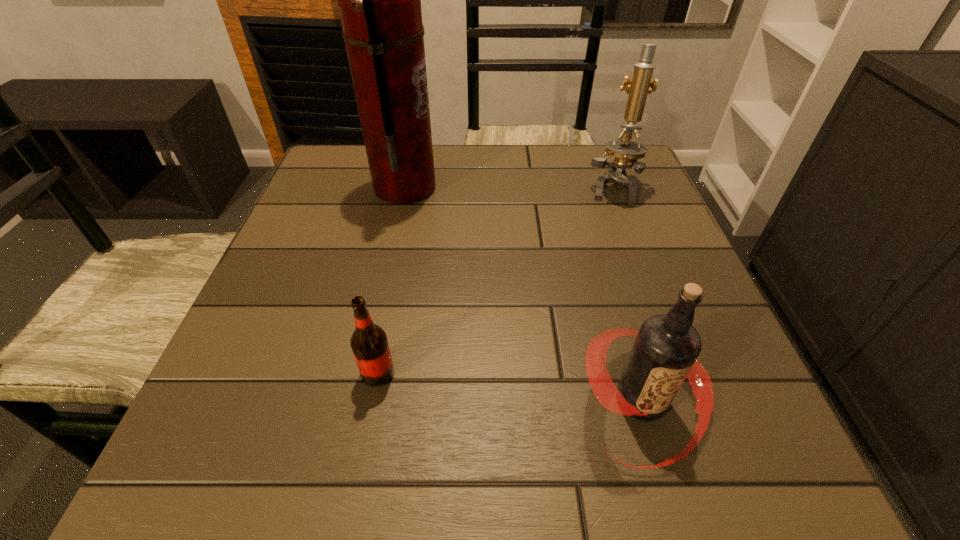
I want to click on vacant area between the tallest object and the shorter root beer, so click(x=392, y=280).

In order to click on empty location between the microscope and the second shortest object in this screenshot , I will do `click(627, 294)`.

You are a GUI agent. You are given a task and a screenshot of the screen. Output one action in this format:
    pyautogui.click(x=<x>, y=<y>)
    Task: Click on the free spot between the taller root beer and the fire extinguisher
    Image resolution: width=960 pixels, height=540 pixels.
    Given the screenshot: What is the action you would take?
    pyautogui.click(x=523, y=294)

Locate an element on the screen. This screenshot has height=540, width=960. free spot between the right root beer and the microscope is located at coordinates (627, 294).

Identify the location of the second closest object to the tallest object. This screenshot has width=960, height=540. (369, 343).

Image resolution: width=960 pixels, height=540 pixels. I want to click on object identified as the second closest to the second shortest object, so click(x=626, y=152).

Find the location of a particular element. This screenshot has height=540, width=960. vacant space that satisfies the following two spatial constraints: 1. on the nozzle side of the tallest object; 2. on the back side of the left root beer is located at coordinates (366, 373).

This screenshot has width=960, height=540. I want to click on vacant area in the image that satisfies the following two spatial constraints: 1. on the nozzle side of the tallest object; 2. on the left side of the shorter root beer, so click(x=366, y=373).